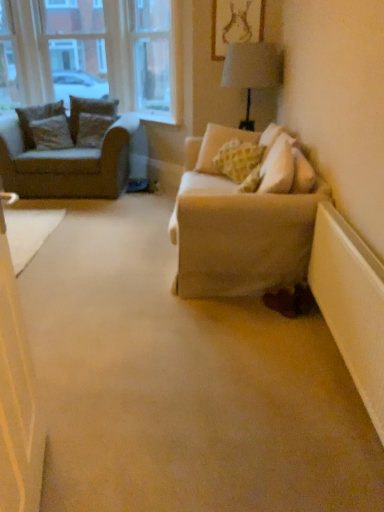
Locate an element on the screen. empty space that is ontop of white plastic radiator at lower right (from a real-world perspective) is located at coordinates (364, 242).